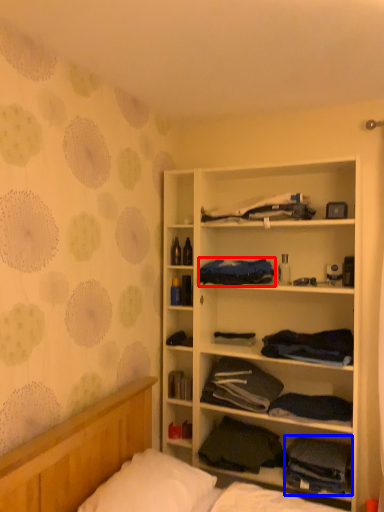
Question: Which of the following is the farthest to the observer, clothing (highlighted by a red box) or clothing (highlighted by a blue box)?

Choices:
 (A) clothing
 (B) clothing

Answer: (A)